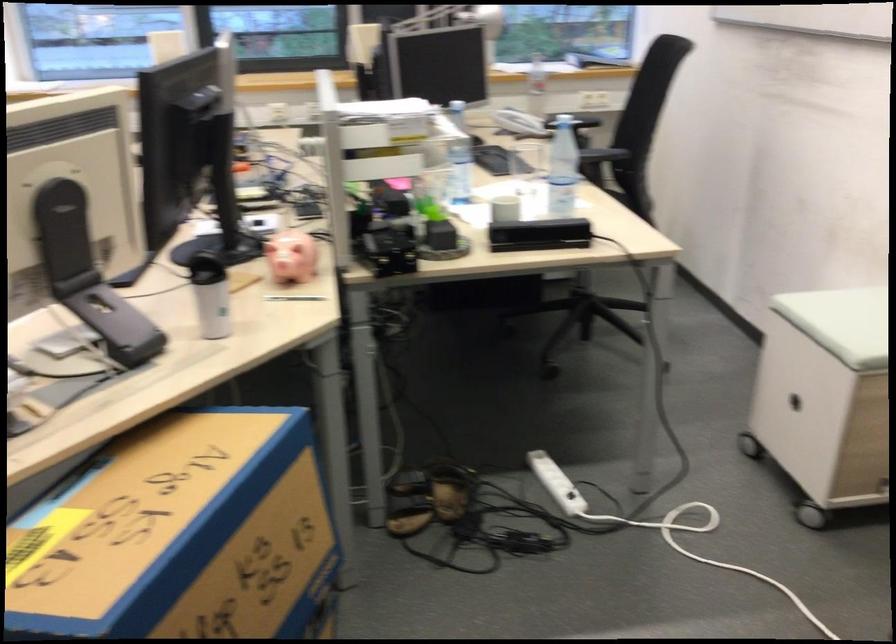
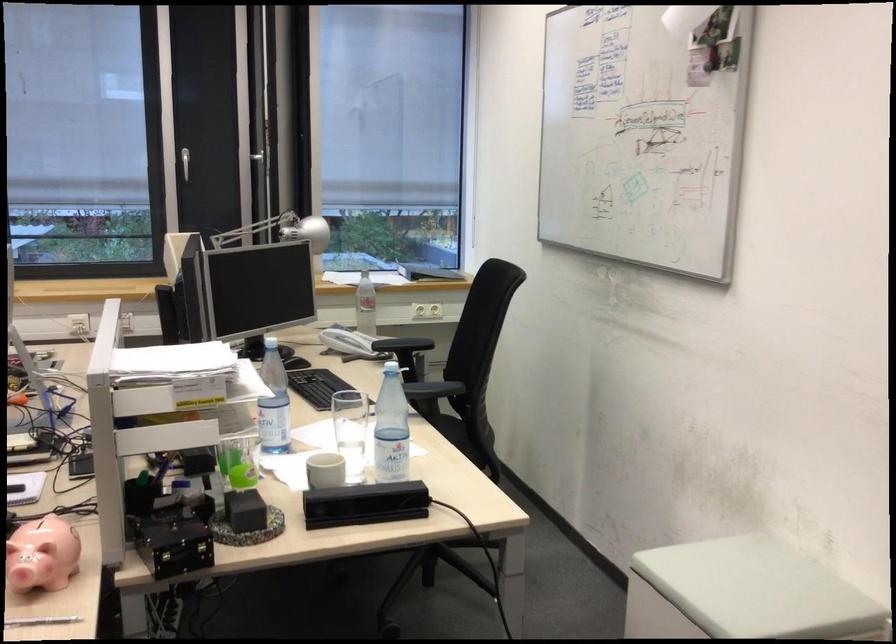
Question: The first image is from the beginning of the video and the second image is from the end. How did the camera likely rotate when shooting the video?

Choices:
 (A) Left
 (B) Right
 (C) Up
 (D) Down

Answer: (C)